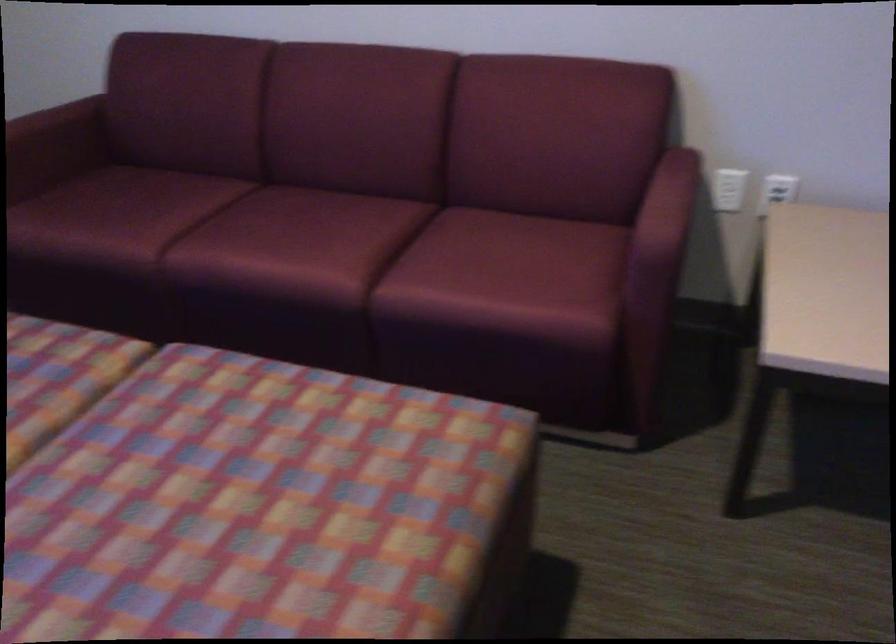
What do you see at coordinates (332, 249) in the screenshot? This screenshot has width=896, height=644. I see `the red sofa sitting surface` at bounding box center [332, 249].